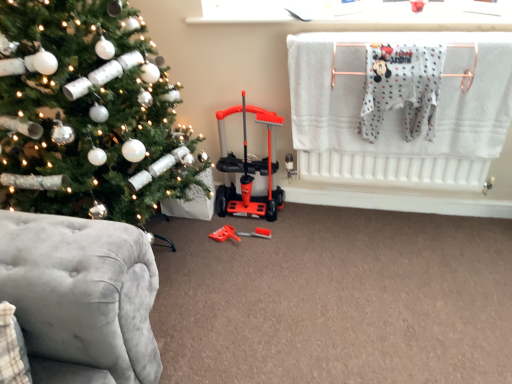
Question: Considering their positions, is orange plastic baby carriage at center located in front of or behind white cotton onesie at upper right?

Choices:
 (A) behind
 (B) front

Answer: (A)

Question: From the image's perspective, is orange plastic baby carriage at center above or below white cotton onesie at upper right?

Choices:
 (A) above
 (B) below

Answer: (B)

Question: Estimate the real-world distances between objects in this image. Which object is closer to the shiny silver ornaments at left?

Choices:
 (A) white cotton onesie at upper right
 (B) orange plastic baby carriage at center
 (C) orange plastic toy at center
 (D) white cotton onesie at upper right

Answer: (B)

Question: Estimate the real-world distances between objects in this image. Which object is farther from the white cotton onesie at upper right?

Choices:
 (A) orange plastic baby carriage at center
 (B) orange plastic toy at center
 (C) white cotton onesie at upper right
 (D) shiny silver ornaments at left

Answer: (B)